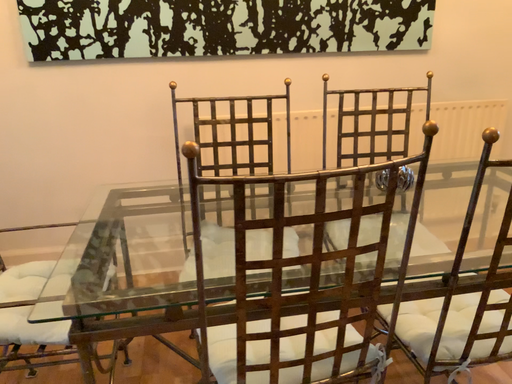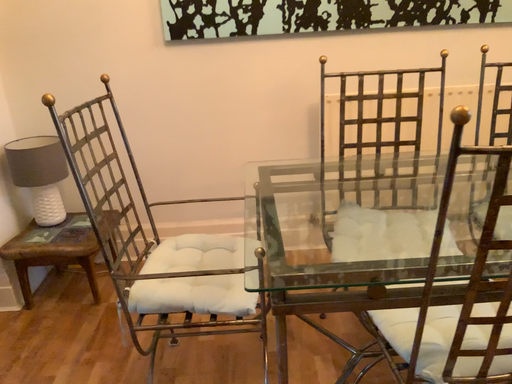
Question: How did the camera likely rotate when shooting the video?

Choices:
 (A) rotated left
 (B) rotated right

Answer: (A)